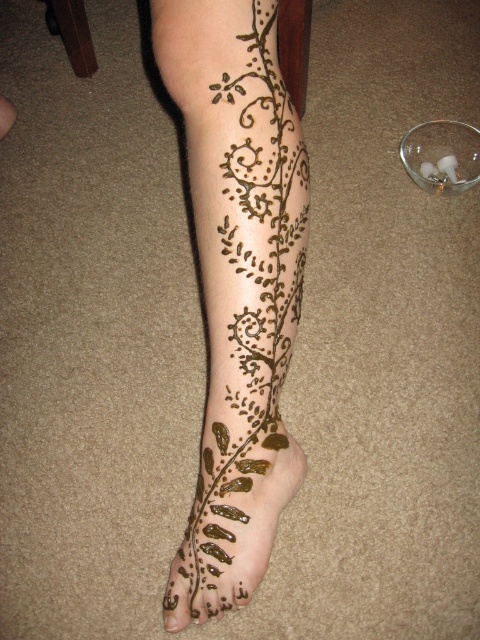
Question: Is brown henna tattoo at lower center above brown matte henna at lower left?

Choices:
 (A) yes
 (B) no

Answer: (A)

Question: Among these objects, which one is nearest to the camera?

Choices:
 (A) brown matte henna at lower left
 (B) brown henna tattoo at lower center

Answer: (B)

Question: Is brown henna tattoo at lower center in front of brown matte henna at lower left?

Choices:
 (A) no
 (B) yes

Answer: (B)

Question: Is brown henna tattoo at lower center closer to the viewer compared to brown matte henna at lower left?

Choices:
 (A) yes
 (B) no

Answer: (A)

Question: Which point is closer to the camera?

Choices:
 (A) brown henna tattoo at lower center
 (B) brown matte henna at lower left

Answer: (A)